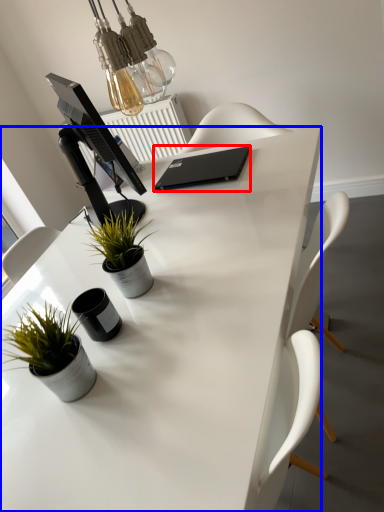
Question: Which of the following is the farthest to the observer, laptop (highlighted by a red box) or desk (highlighted by a blue box)?

Choices:
 (A) laptop
 (B) desk

Answer: (A)